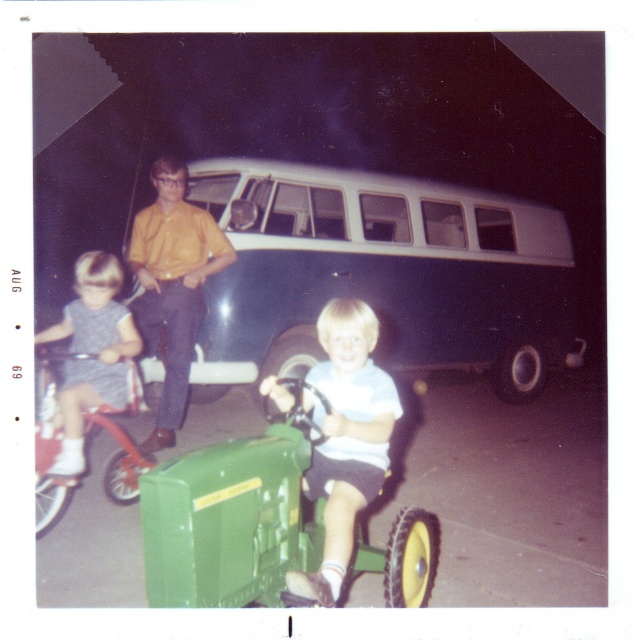
Question: Is yellow shirt at center further to the viewer compared to denim shorts at left?

Choices:
 (A) no
 (B) yes

Answer: (B)

Question: Which point is closer to the camera taking this photo?

Choices:
 (A) (36, 362)
 (B) (157, 172)
 (C) (281, 449)

Answer: (C)

Question: Is the position of matte green tractor at center more distant than that of denim shorts at left?

Choices:
 (A) no
 (B) yes

Answer: (A)

Question: Which object is closer to the camera taking this photo?

Choices:
 (A) yellow shirt at center
 (B) matte green tractor at center
 (C) blue matte van at center

Answer: (B)

Question: Which point is closer to the camera taking this photo?

Choices:
 (A) (41, 438)
 (B) (224, 538)

Answer: (B)

Question: Is matte green tractor at center to the left of yellow shirt at center from the viewer's perspective?

Choices:
 (A) yes
 (B) no

Answer: (B)